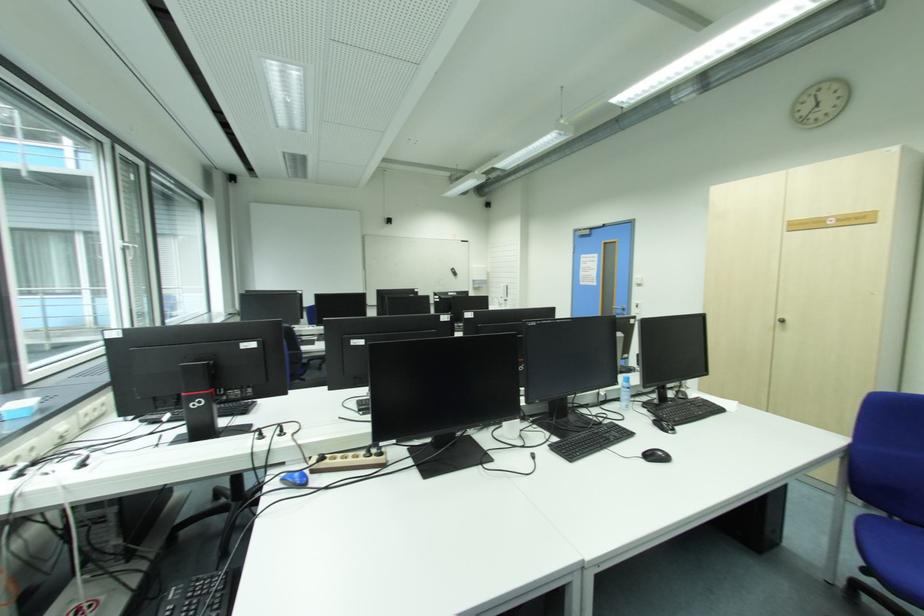
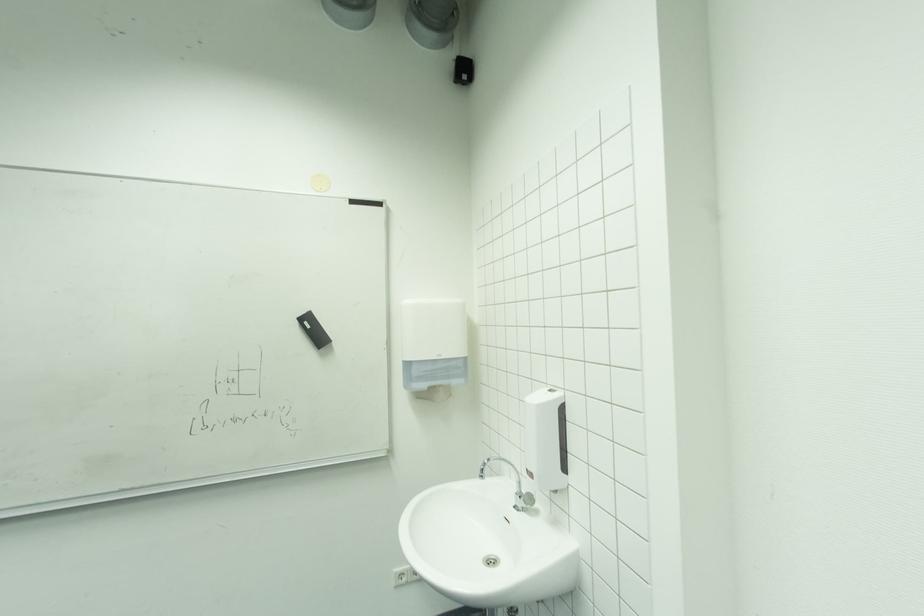
Where in the second image is the point corresponding to the point at 479,282 from the first image?

(412, 365)